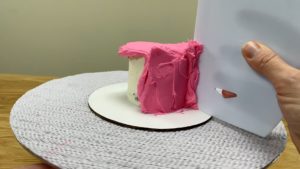
Locate an element on the screen. wooden table is located at coordinates (14, 157).